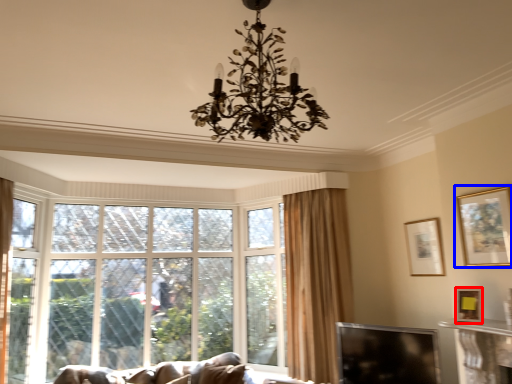
Question: Which of the following is the closest to the observer, picture frame (highlighted by a red box) or picture frame (highlighted by a blue box)?

Choices:
 (A) picture frame
 (B) picture frame

Answer: (B)